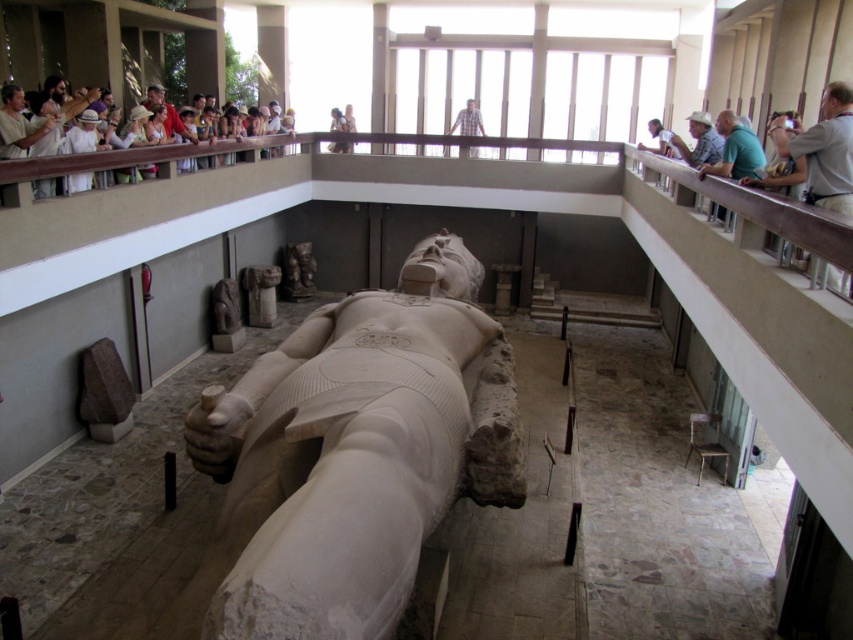
Question: Which object appears farthest from the camera in this image?

Choices:
 (A) dark brown stone statue at center
 (B) smooth stone statue at center

Answer: (A)

Question: Observing the image, what is the correct spatial positioning of white stone statue at center in reference to plaid shirt at upper center?

Choices:
 (A) left
 (B) right

Answer: (A)

Question: Is white stone statue at center below light brown leather hat at upper right?

Choices:
 (A) no
 (B) yes

Answer: (B)

Question: Where is smooth stone column at center located in relation to plaid shirt at upper center in the image?

Choices:
 (A) right
 (B) left

Answer: (B)

Question: Which object is farther from the camera taking this photo?

Choices:
 (A) smooth stone statue at center
 (B) plaid shirt at upper center

Answer: (B)

Question: Which point is farther to the camera?

Choices:
 (A) light brown leather hat at upper right
 (B) light brown wooden chair at upper center

Answer: (B)